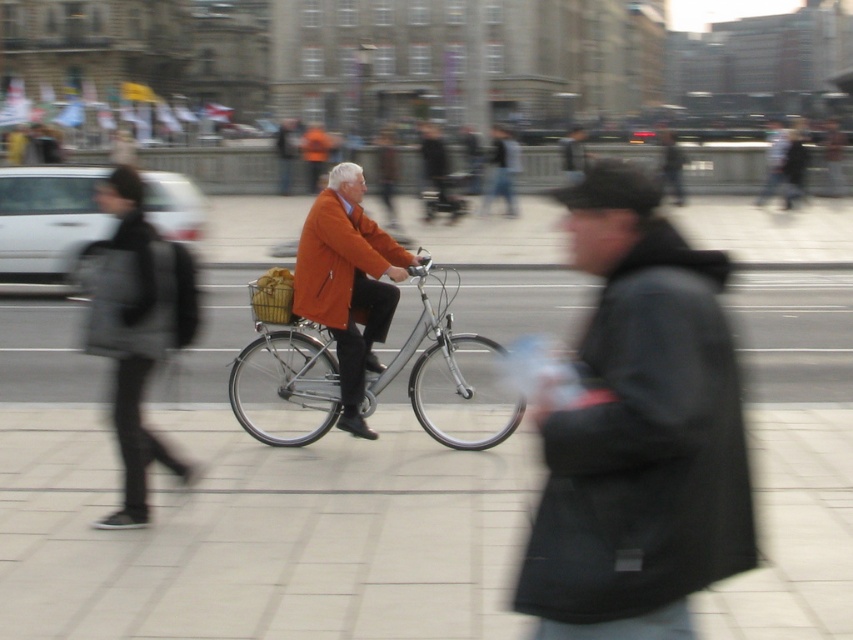
Between point (65, 563) and point (171, 336), which one is positioned in front?

Point (65, 563)

Identify the location of smooth concrete pavement at center. (260, 532).

At what (x,y) coordinates should I click in order to perform the action: click on smooth concrete pavement at center. Please return your answer as a coordinate pair (x, y). This screenshot has height=640, width=853. Looking at the image, I should click on (260, 532).

Can you confirm if orange matte coat at center is wider than orange matte jacket at center?

Yes.

Between orange matte coat at center and orange matte jacket at center, which one appears on the right side from the viewer's perspective?

orange matte coat at center

Locate an element on the screen. orange matte coat at center is located at coordinates (347, 284).

Does black fabric backpack at left have a greater height compared to silver metallic bicycle at center?

Yes.

Which is more to the left, black fabric backpack at left or silver metallic bicycle at center?

From the viewer's perspective, black fabric backpack at left appears more on the left side.

Who is more forward, (119, 301) or (515, 420)?

Positioned in front is point (119, 301).

You are a GUI agent. You are given a task and a screenshot of the screen. Output one action in this format:
    pyautogui.click(x=<x>, y=<y>)
    Task: Click on the black fabric backpack at left
    Image resolution: width=853 pixels, height=640 pixels.
    Given the screenshot: What is the action you would take?
    pyautogui.click(x=137, y=330)